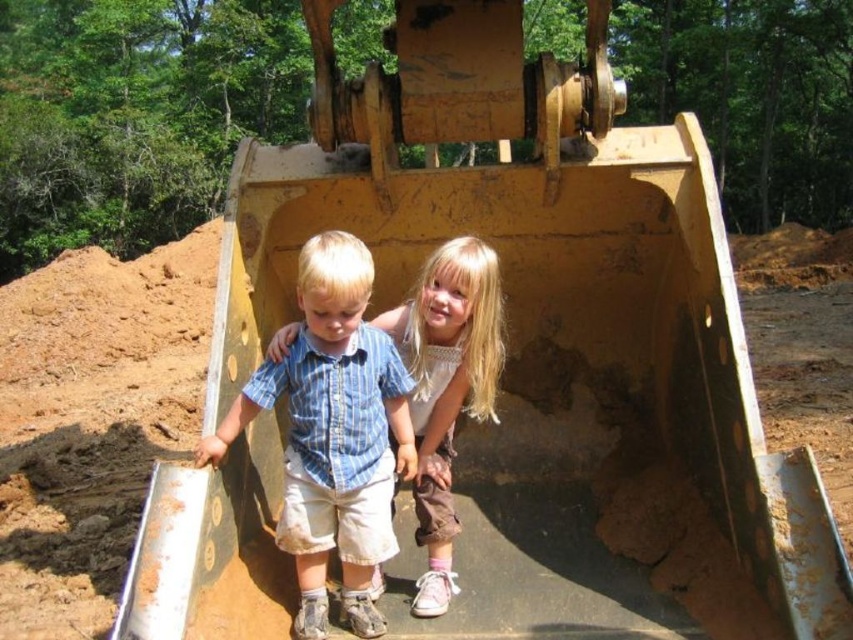
Question: Does blue striped shirt at center lie in front of smooth white shirt at center?

Choices:
 (A) yes
 (B) no

Answer: (A)

Question: Where is blue striped shirt at center located in relation to smooth white shirt at center in the image?

Choices:
 (A) left
 (B) right

Answer: (A)

Question: Can you confirm if blue striped shirt at center is positioned to the right of smooth white shirt at center?

Choices:
 (A) no
 (B) yes

Answer: (A)

Question: Among these points, which one is nearest to the camera?

Choices:
 (A) (426, 332)
 (B) (326, 288)

Answer: (B)